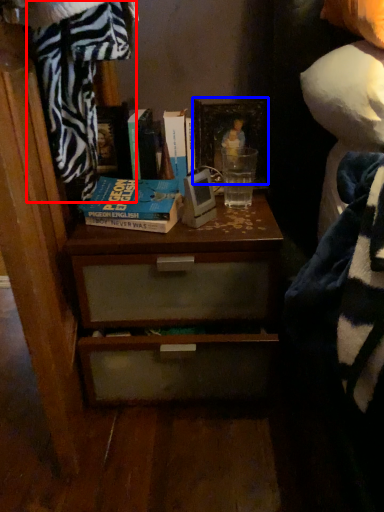
Question: Which object is further to the camera taking this photo, blanket (highlighted by a red box) or picture frame (highlighted by a blue box)?

Choices:
 (A) blanket
 (B) picture frame

Answer: (B)